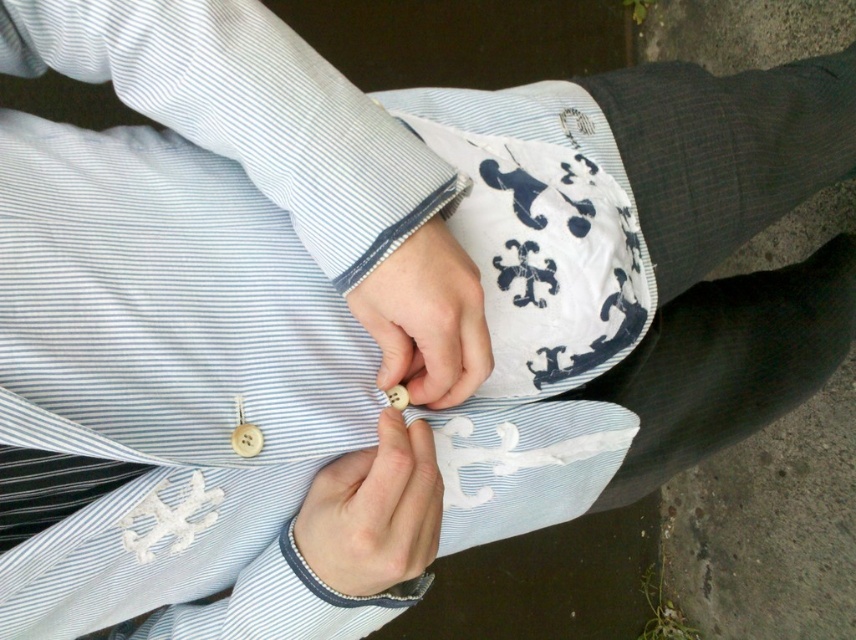
You are taking a photo of the scene and want to focus on both the point at point (373,580) and point (403,324). Which point is closer to the camera?

Point (403,324) is closer to the camera than point (373,580) because the description states that point (373,580) is further away.

You are a tailor measuring the placement of buttons on a shirt. The shirt has a total of 10 buttons, each spaced 1.5 cm apart vertically. The first button is placed at the midpoint of the shirt. If the white matte button at center is the 5th button from the top, what is its vertical position relative to the first button?

The white matte button at center is the 5th button from the top, so it is 6 cm below the first button since each button is spaced 1.5 cm apart. Therefore, its vertical position is 6 cm below the first button.